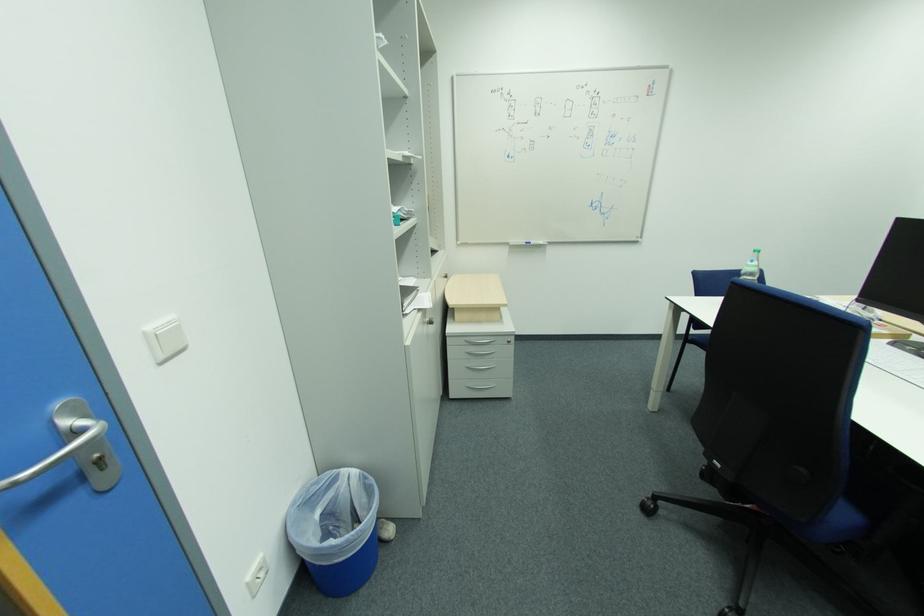
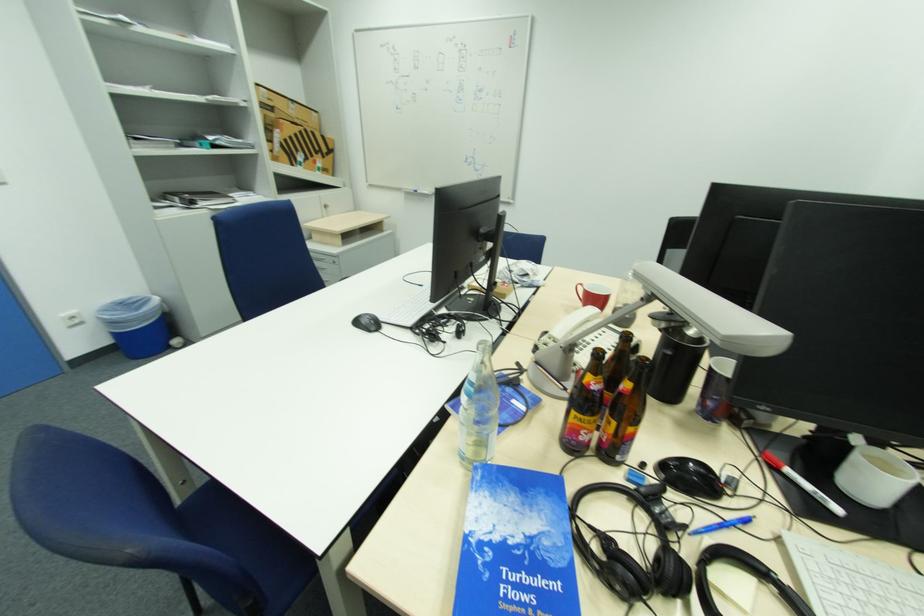
Question: What movement of the cameraman would produce the second image?

Choices:
 (A) Left
 (B) Right
 (C) Forward
 (D) Backward

Answer: (B)